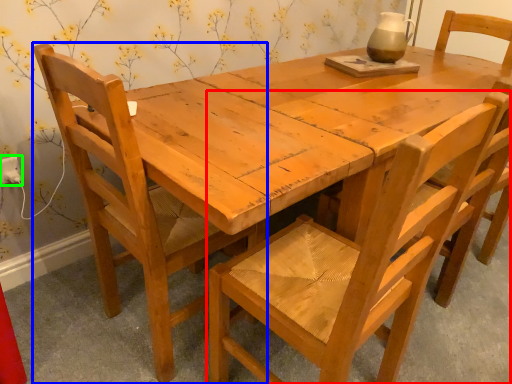
Question: Considering the real-world distances, which object is closest to chair (highlighted by a red box)? chair (highlighted by a blue box) or electric outlet (highlighted by a green box).

Choices:
 (A) chair
 (B) electric outlet

Answer: (A)